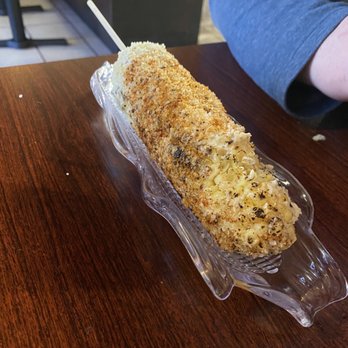
Locate an element on the screen. Image resolution: width=348 pixels, height=348 pixels. white tile floor top left corner is located at coordinates (21, 56), (67, 28).